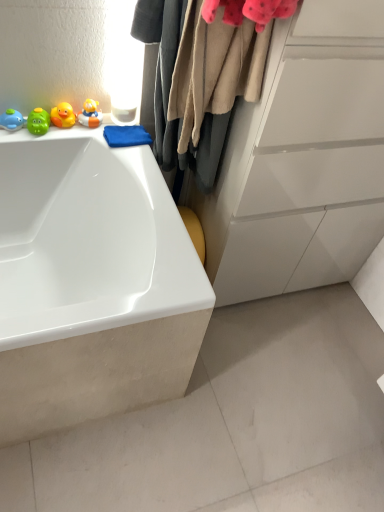
Locate an element on the screen. The height and width of the screenshot is (512, 384). vacant point to the right of white glossy bathtub at upper left is located at coordinates (251, 391).